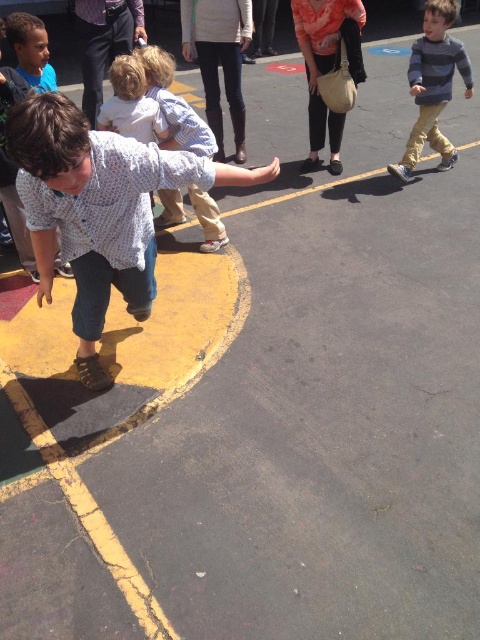
Question: Does denim jeans at left come in front of striped cotton shirt at upper right?

Choices:
 (A) yes
 (B) no

Answer: (A)

Question: Which point is farther to the camera?

Choices:
 (A) [414, 140]
 (B) [93, 376]

Answer: (A)

Question: Is denim jeans at left above light brown hair at upper center?

Choices:
 (A) no
 (B) yes

Answer: (A)

Question: Which of the following is the farthest from the observer?

Choices:
 (A) (81, 122)
 (B) (171, 132)
 (C) (92, 44)

Answer: (C)

Question: Does light blue shirt at center lie behind dark gray pants at upper center?

Choices:
 (A) yes
 (B) no

Answer: (B)

Question: Which point appears farthest from the camera in this image?

Choices:
 (A) click(91, 22)
 (B) click(166, 67)
 (C) click(88, 296)

Answer: (A)